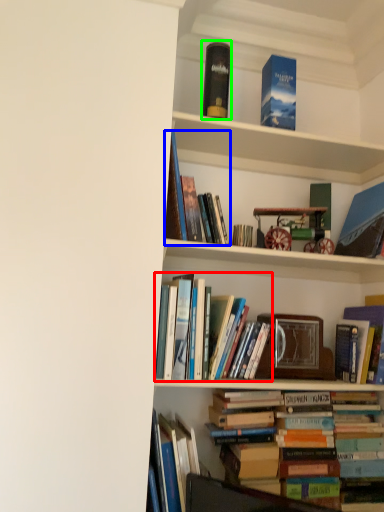
Question: Considering the real-world distances, which object is closest to book (highlighted by a red box)? book (highlighted by a blue box) or paperback book (highlighted by a green box).

Choices:
 (A) book
 (B) paperback book

Answer: (A)